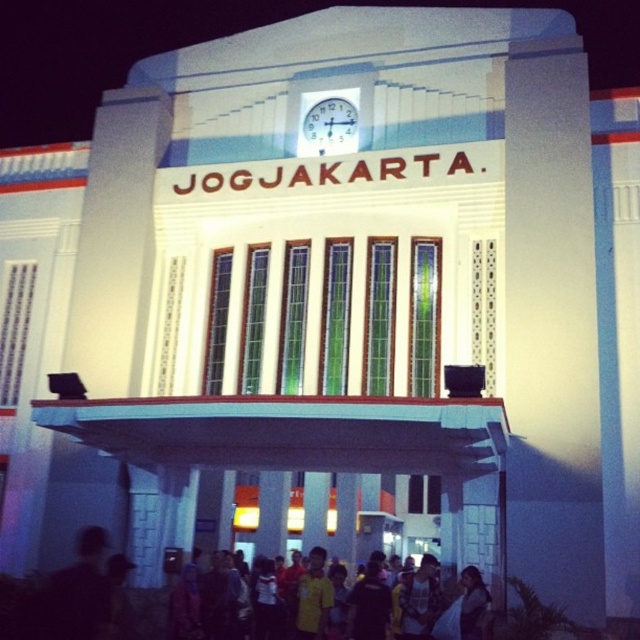
Consider the image. You are a photographer standing in front of the building. You want to take a photo that includes both the yellow shirt at lower center and the white plastic clock at upper center. Which object should you focus on first to ensure both are in frame?

The yellow shirt at lower center is much taller than the white plastic clock at upper center, so you should focus on the yellow shirt at lower center first to ensure both are in frame.

You are standing in front of the building at night. There is a point marked at coordinates (442, 605). Based on the scene description, what object or feature is located at that point?

The point at coordinates (442, 605) is on the yellow shirt at lower center.